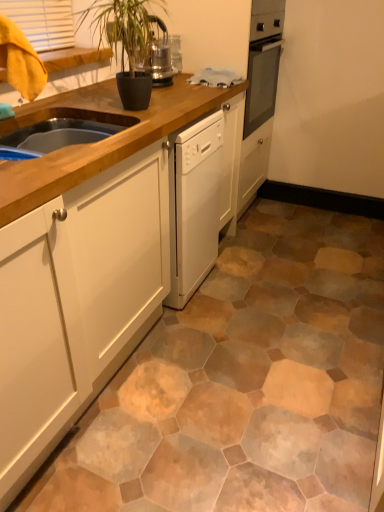
At what (x,y) coordinates should I click in order to perform the action: click on free space to the right of dark green glossy plant at upper center. Please return your answer as a coordinate pair (x, y). Looking at the image, I should click on (187, 99).